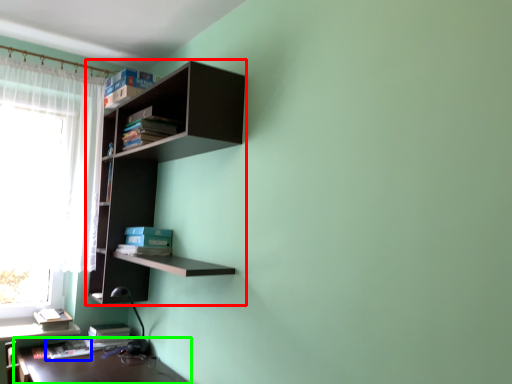
Question: Based on their relative distances, which object is farther from shelf (highlighted by a red box)? Choose from book (highlighted by a blue box) and table (highlighted by a green box).

Choices:
 (A) book
 (B) table

Answer: (A)